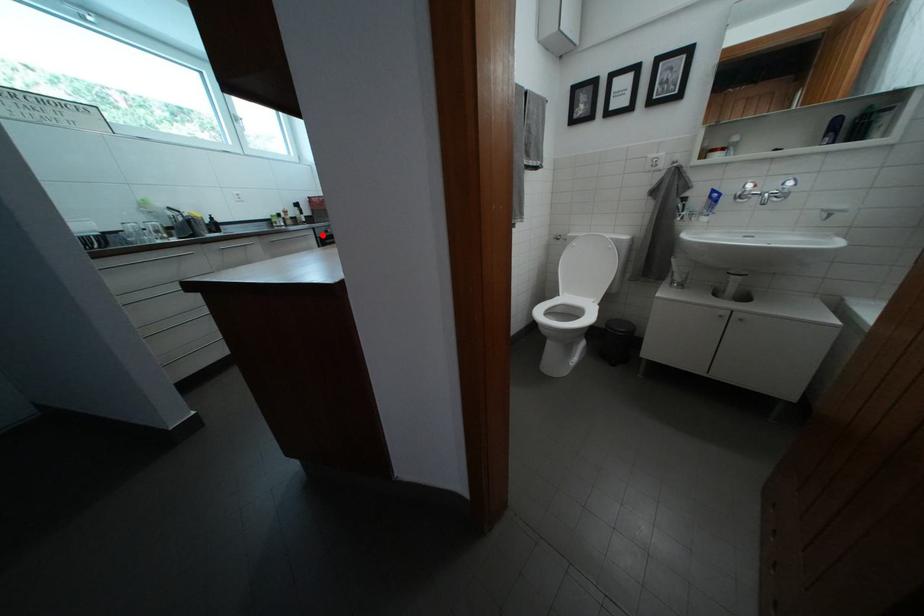
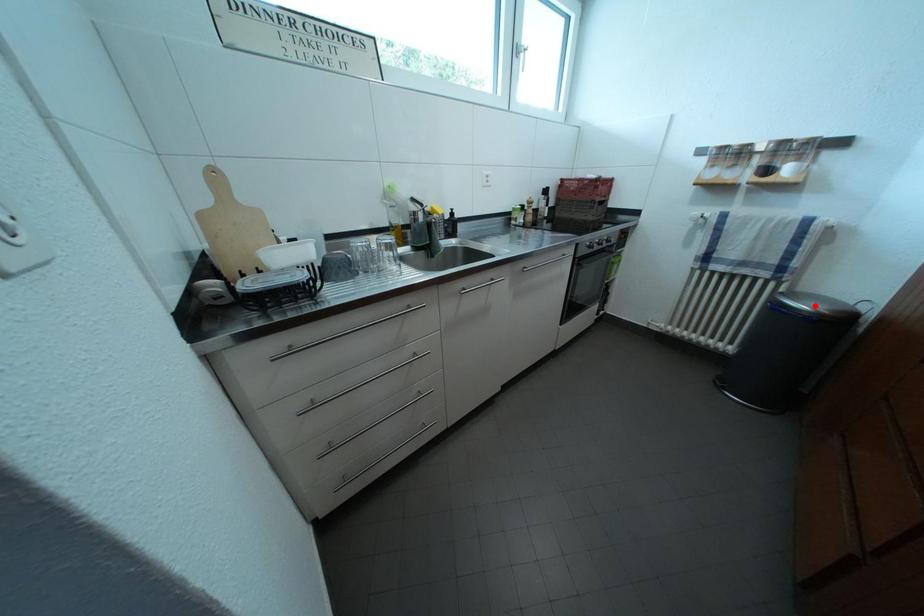
I am providing you with two images of the same scene from different viewpoints. A red point is marked on the first image and another point is marked on the second image. Is the marked point in image1 the same physical position as the marked point in image2?

No